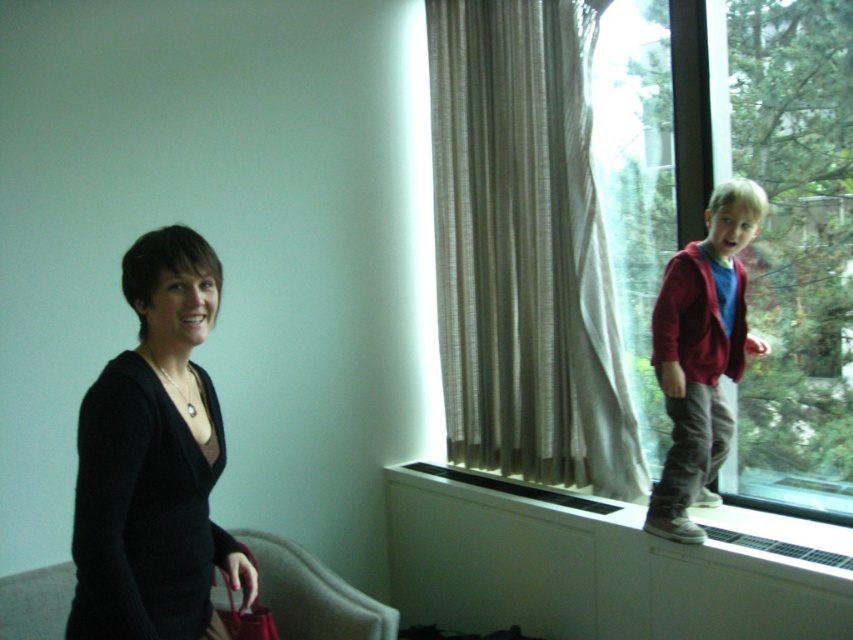
You are planning to place a new painting that is 1.2 meters wide on the wall where the beige textured curtain at window is currently hanging. Considering the space available, will the painting fit without overlapping the velvet beige armchair at lower left?

The beige textured curtain at window is wider than the velvet beige armchair at lower left. Since the painting is 1.2 meters wide, it should fit as long as the curtain area is wide enough. However, the exact placement depends on the distance between the curtain and the armchair, which isn

You are standing in the room and want to open the window to let some fresh air in. Which object, the beige textured curtain at window or the black matte sweater at left, is closer to the window so you can reach it without moving the other object?

The beige textured curtain at window is closer to the window than the black matte sweater at left, so you can reach it without moving the other object.

You are standing in the room and want to hand a small gift to the person wearing the black matte sweater at left without moving closer than 5 feet. Can you reach them from your current position?

The black matte sweater at left is 4.95 feet away from the viewer, so you can reach them without moving closer than 5 feet since the distance is just under 5 feet.